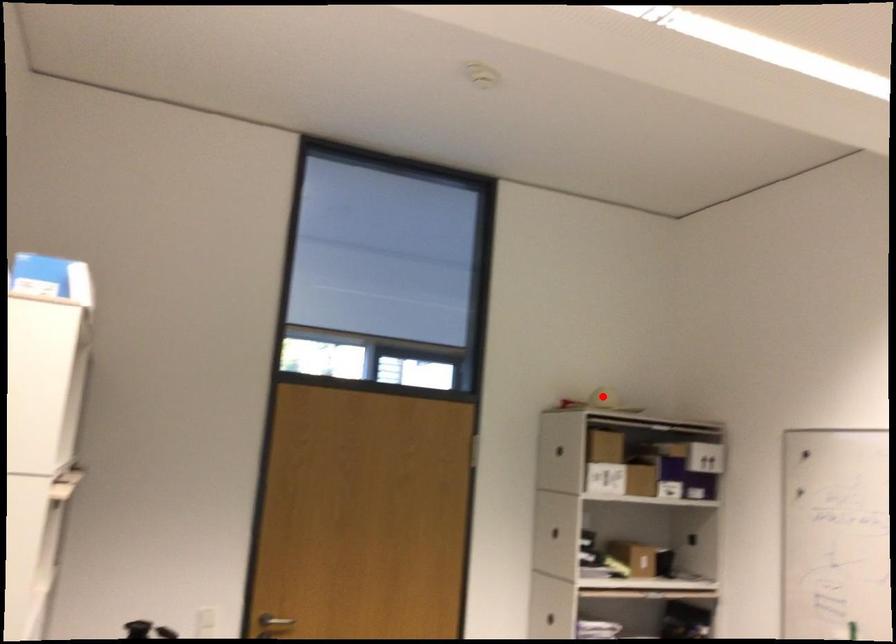
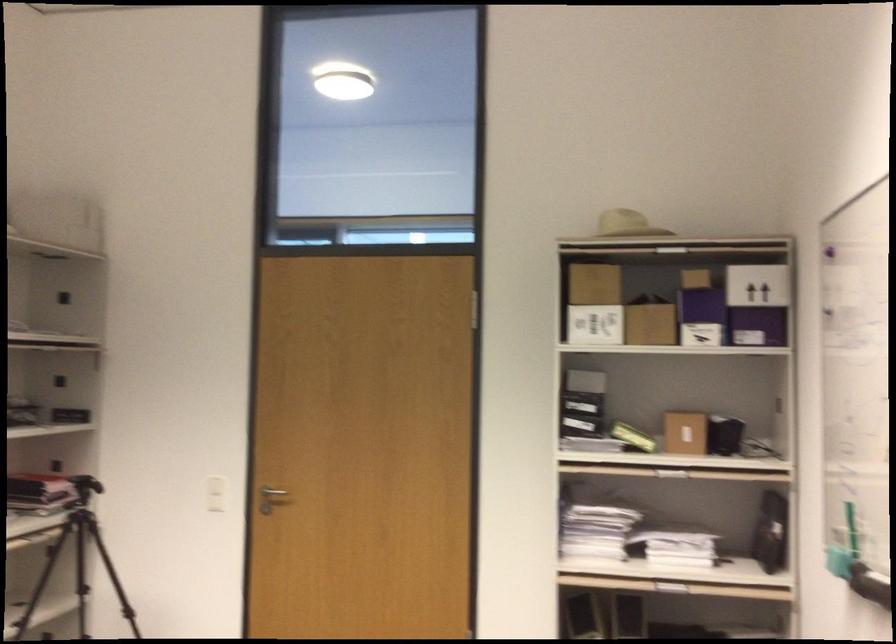
Question: I am providing you with two images of the same scene from different viewpoints. Image1 has a red point marked. In image2, the corresponding 3D location appears at what relative position? Reply with the corresponding letter.

Choices:
 (A) Closer
 (B) Farther

Answer: (A)